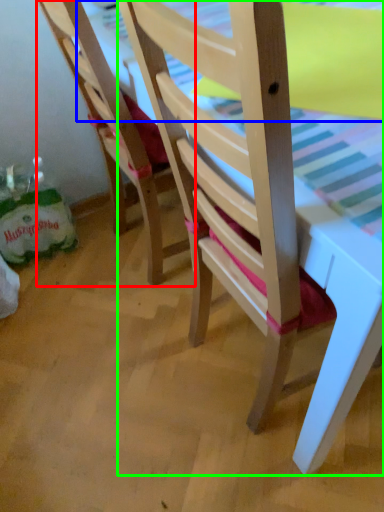
Question: Considering the real-world distances, which object is farthest from chair (highlighted by a red box)? table top (highlighted by a blue box) or chair (highlighted by a green box)?

Choices:
 (A) table top
 (B) chair

Answer: (B)